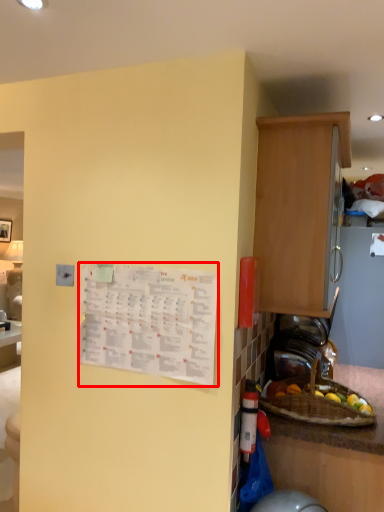
Question: Where is poster (annotated by the red box) located in relation to cabinetry in the image?

Choices:
 (A) right
 (B) left

Answer: (B)